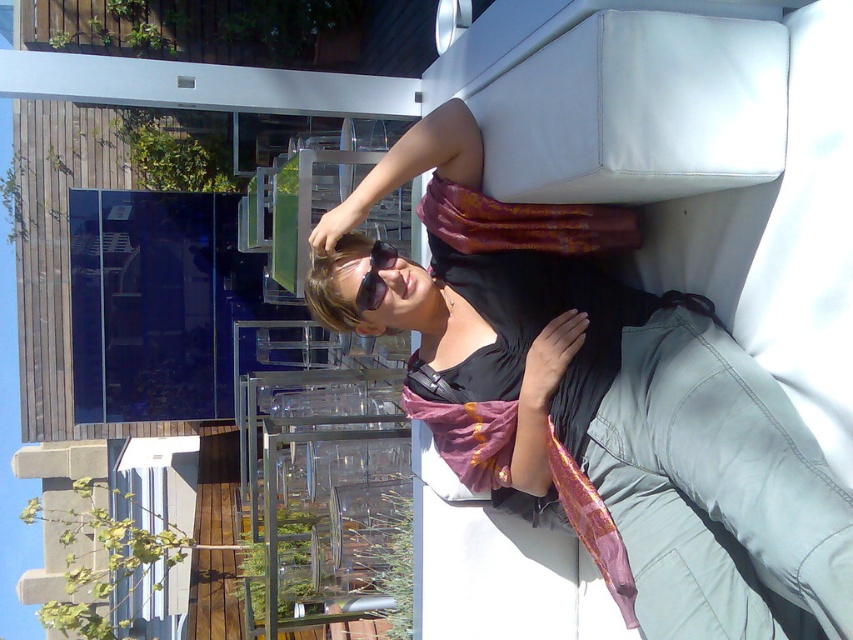
Based on the photo, measure the distance between point (809, 605) and camera.

They are 5.56 feet apart.

Is matte black scarf at center taller than black plastic goggles at upper center?

Indeed, matte black scarf at center has a greater height compared to black plastic goggles at upper center.

Where is `matte black scarf at center`? matte black scarf at center is located at coordinates (601, 406).

Identify the location of matte black scarf at center. (601, 406).